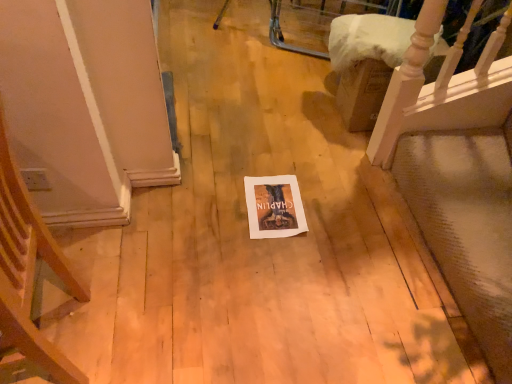
Where is `vacant area to the left of white paper at center`? Image resolution: width=512 pixels, height=384 pixels. vacant area to the left of white paper at center is located at coordinates (216, 210).